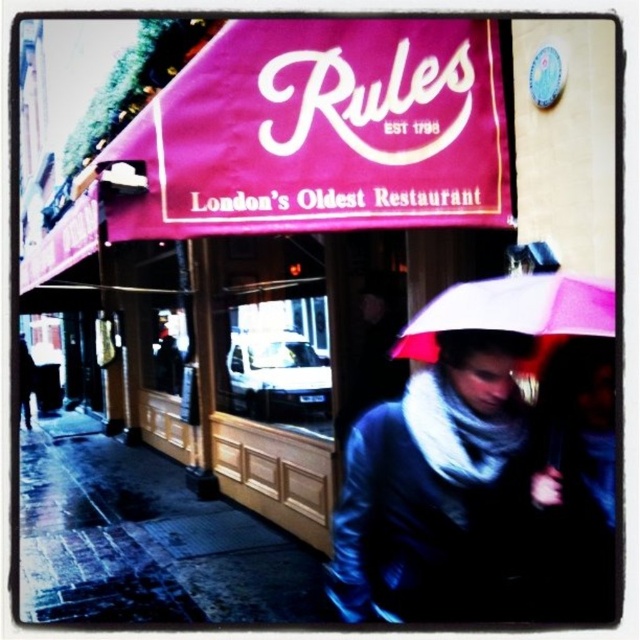
Question: Can you confirm if matte black jacket at center is thinner than wet asphalt at lower left?

Choices:
 (A) yes
 (B) no

Answer: (B)

Question: Among these objects, which one is farthest from the camera?

Choices:
 (A) matte black jacket at center
 (B) wet asphalt at lower left
 (C) pink matte umbrella at lower center

Answer: (B)

Question: Can you confirm if matte black jacket at center is positioned to the right of wet asphalt at lower left?

Choices:
 (A) yes
 (B) no

Answer: (A)

Question: Which point is closer to the camera taking this photo?

Choices:
 (A) (163, 580)
 (B) (435, 595)
 (C) (522, 371)

Answer: (B)

Question: Is matte black jacket at center to the left of pink matte umbrella at lower center from the viewer's perspective?

Choices:
 (A) yes
 (B) no

Answer: (A)

Question: Which point is closer to the camera?

Choices:
 (A) (538, 339)
 (B) (509, 493)

Answer: (B)